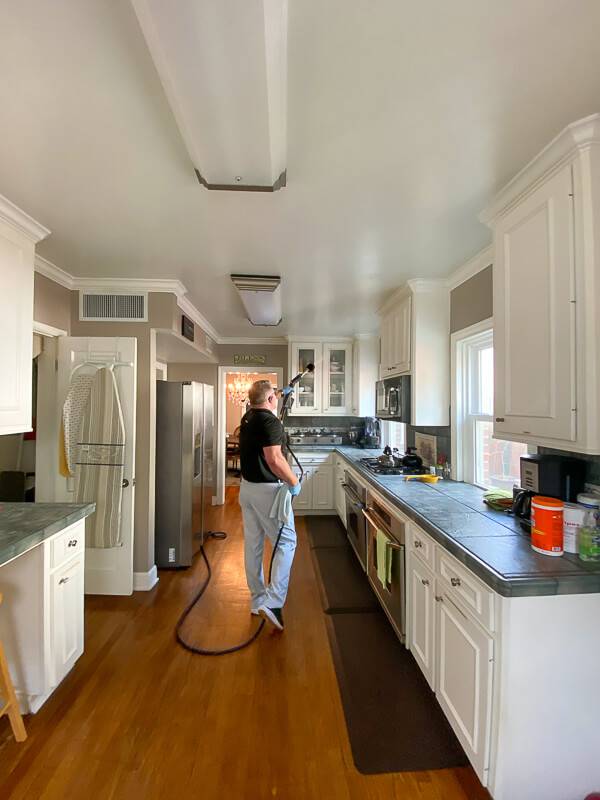
This screenshot has height=800, width=600. In order to click on brown mats on hardwood floor in this screenshot , I will do `click(388, 692)`, `click(341, 573)`, `click(323, 528)`.